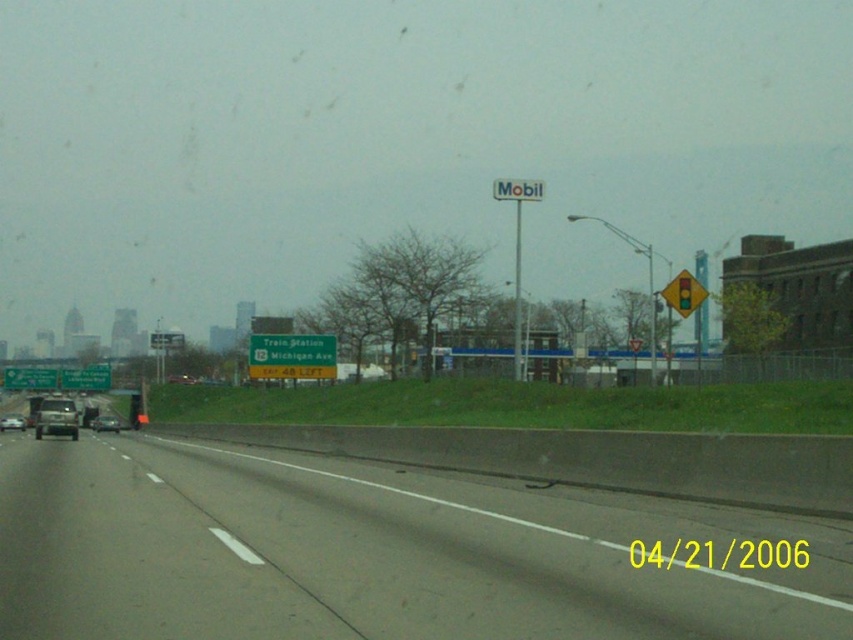
Is point (114, 420) positioned before point (20, 424)?

That is False.

Does metallic silver sedan at center appear on the left side of matte black car at left?

Incorrect, metallic silver sedan at center is not on the left side of matte black car at left.

Between point (103, 426) and point (10, 413), which one is positioned in front?

Positioned in front is point (103, 426).

Where is `metallic silver sedan at center`? Image resolution: width=853 pixels, height=640 pixels. metallic silver sedan at center is located at coordinates (105, 422).

Who is positioned more to the right, metallic silver sedan at left or transparent glass windshield at left?

Positioned to the right is metallic silver sedan at left.

At what (x,y) coordinates should I click in order to perform the action: click on metallic silver sedan at left. Please return your answer as a coordinate pair (x, y). This screenshot has width=853, height=640. Looking at the image, I should click on (56, 417).

Between green metallic sign at center and green metallic sign at upper center, which one is positioned higher?

green metallic sign at upper center is above.

Can you confirm if green metallic sign at center is wider than green metallic sign at upper center?

No.

Does point (331, 371) come behind point (173, 342)?

No.

Where is `green metallic sign at center`? This screenshot has height=640, width=853. green metallic sign at center is located at coordinates (291, 356).